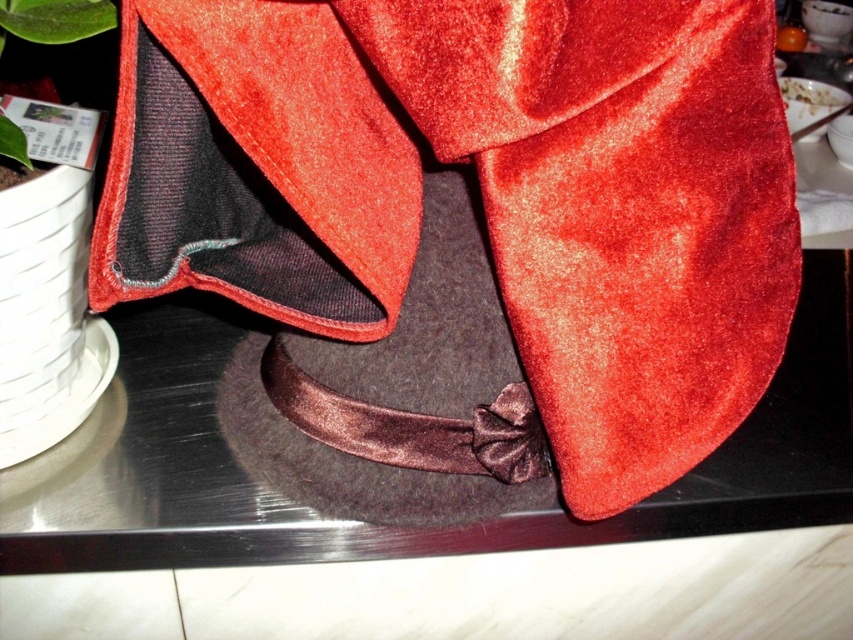
Question: Does velvet red cape at center appear over white creamy food at upper right?

Choices:
 (A) yes
 (B) no

Answer: (B)

Question: Estimate the real-world distances between objects in this image. Which object is farther from the velvet red cape at center?

Choices:
 (A) white creamy food at upper right
 (B) green matte leaf at upper left

Answer: (A)

Question: Does green matte leaf at upper left have a greater width compared to white creamy food at upper right?

Choices:
 (A) yes
 (B) no

Answer: (A)

Question: Based on their relative distances, which object is farther from the velvet red cape at center?

Choices:
 (A) white creamy food at upper right
 (B) green matte leaf at upper left

Answer: (A)

Question: Does velvet red cape at center have a larger size compared to white creamy food at upper right?

Choices:
 (A) yes
 (B) no

Answer: (A)

Question: Which object is closer to the camera taking this photo?

Choices:
 (A) velvet red cape at center
 (B) white creamy food at upper right
 (C) green matte leaf at upper left

Answer: (A)